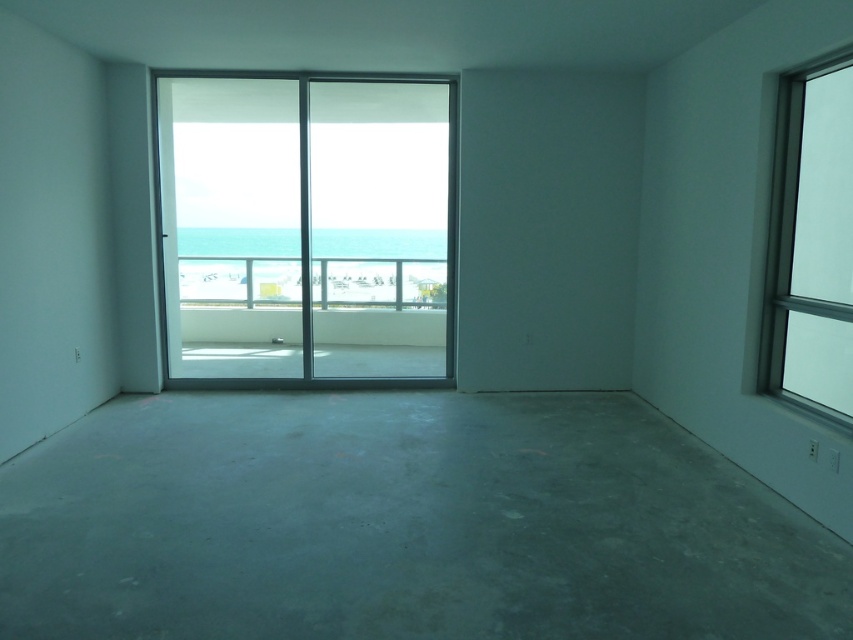
You are standing in the room and want to exit to the balcony. There is a point marked at coordinates (x=306, y=228) which indicates the location of the transparent glass screen door at center. Can you walk directly to the transparent glass screen door at center from your current position without any obstacles?

Yes, you can walk directly to the transparent glass screen door at center from your current position without any obstacles because the room is described as empty with a minimalist design, suggesting no furniture or objects blocking the path.

You are standing inside the room and want to exit to the balcony. The transparent glass screen door at center and the clear glass window at right are both in front of you. Which one should you approach to reach the balcony?

The transparent glass screen door at center is positioned on the left side of clear glass window at right, so you should approach the transparent glass screen door at center to exit to the balcony since it is a door and likely leads outside.

You are designing a new interior layout for this room and need to place a large sofa. The sofa is 2 meters wide. You have two options for placement. One is in front of the transparent glass screen door at center and the other is in front of the clear glass window at right. Which location has enough space for the sofa?

The transparent glass screen door at center is bigger than the clear glass window at right, so placing the sofa in front of the transparent glass screen door at center would provide sufficient space since it is larger.